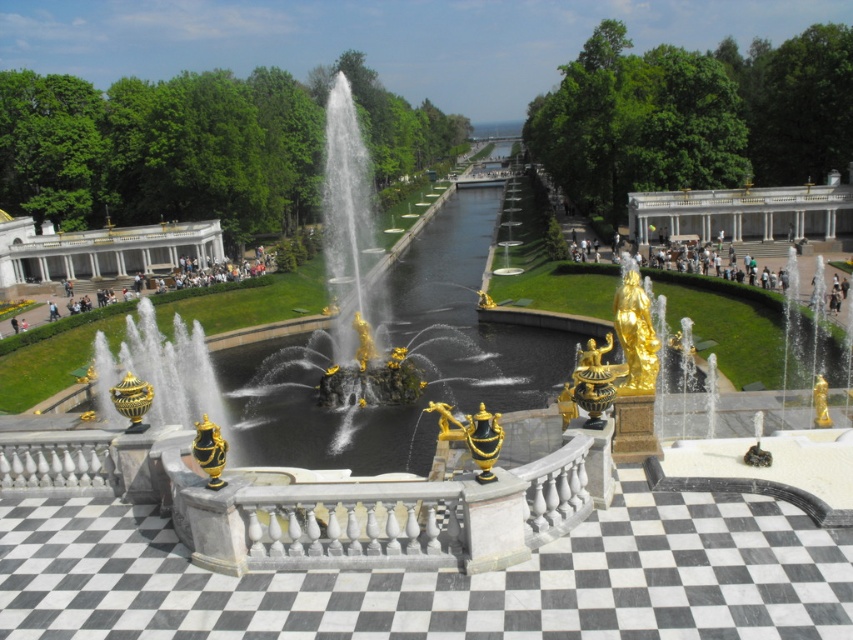
In the scene shown: Does white marble palace at upper right have a lesser height compared to gold polished vase at center?

In fact, white marble palace at upper right may be taller than gold polished vase at center.

Based on the photo, does white marble palace at upper right have a lesser width compared to gold polished vase at center?

In fact, white marble palace at upper right might be wider than gold polished vase at center.

Who is more forward, (759,196) or (221,460)?

Point (221,460) is more forward.

The width and height of the screenshot is (853, 640). I want to click on white marble palace at upper right, so click(743, 212).

Is white marble palace at upper right smaller than white marble palace at left?

No.

Can you confirm if white marble palace at upper right is shorter than white marble palace at left?

Incorrect, white marble palace at upper right's height does not fall short of white marble palace at left's.

Is point (846, 212) in front of point (189, 227)?

Yes.

You are a GUI agent. You are given a task and a screenshot of the screen. Output one action in this format:
    pyautogui.click(x=<x>, y=<y>)
    Task: Click on the white marble palace at upper right
    
    Given the screenshot: What is the action you would take?
    pyautogui.click(x=743, y=212)

Can you confirm if gold polished vase at center is positioned above gold polished statue at center-right?

No.

Is point (200, 440) farther from camera compared to point (815, 378)?

No, it is not.

Find the location of `gold polished vase at center`. gold polished vase at center is located at coordinates (209, 451).